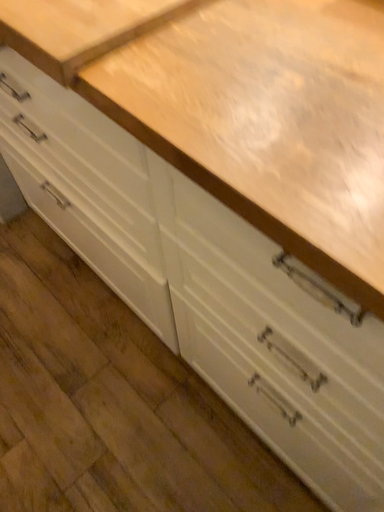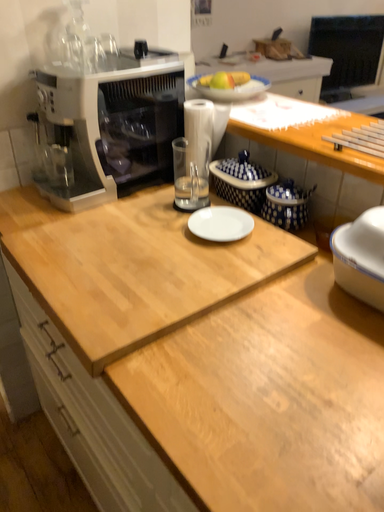
Question: Which way did the camera rotate in the video?

Choices:
 (A) rotated downward
 (B) rotated upward

Answer: (B)